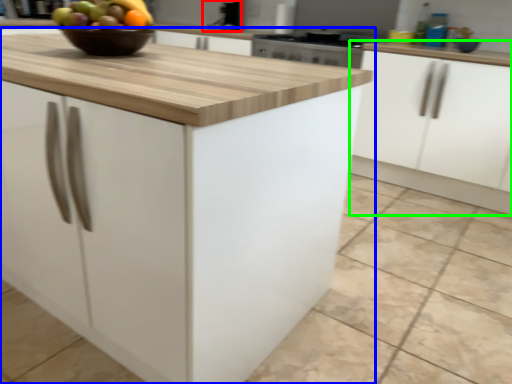
Question: Estimate the real-world distances between objects in this image. Which object is closer to sink (highlighted by a red box), cabinetry (highlighted by a blue box) or cabinetry (highlighted by a green box)?

Choices:
 (A) cabinetry
 (B) cabinetry

Answer: (B)